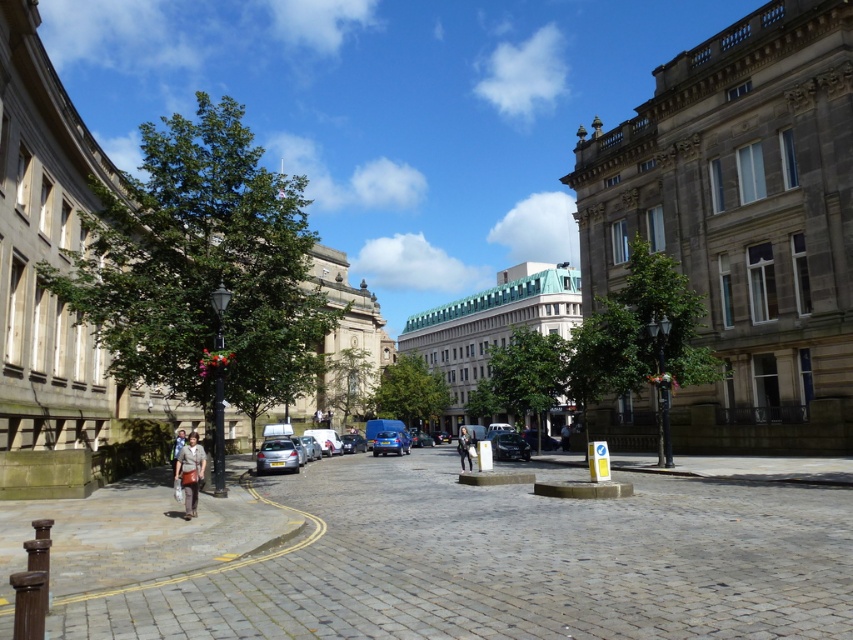
Question: Based on their relative distances, which object is farther from the gray cobblestone pavement at center?

Choices:
 (A) shiny black car at center
 (B) matte brown coat at lower left
 (C) dark gray sweater at center
 (D) dark blue jeans at center

Answer: (D)

Question: Among these objects, which one is nearest to the camera?

Choices:
 (A) dark gray sweater at center
 (B) gray cobblestone pavement at center
 (C) dark blue jeans at center
 (D) metallic silver car at lower left

Answer: (B)

Question: Does matte brown coat at lower left appear under shiny black car at center?

Choices:
 (A) no
 (B) yes

Answer: (A)

Question: Is gray cobblestone pavement at center further to camera compared to matte brown coat at lower left?

Choices:
 (A) no
 (B) yes

Answer: (A)

Question: Can you confirm if metallic silver car at lower left is smaller than dark gray sweater at center?

Choices:
 (A) yes
 (B) no

Answer: (A)

Question: Which of these objects is positioned closest to the metallic silver car at center?

Choices:
 (A) dark gray sweater at center
 (B) shiny black car at center

Answer: (A)